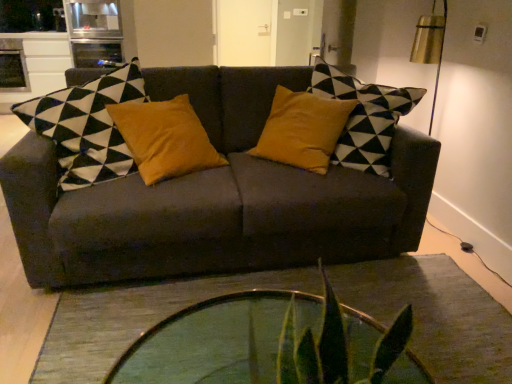
Question: Is dark gray fabric couch at center inside the boundaries of transparent glass coffee table at center, or outside?

Choices:
 (A) outside
 (B) inside

Answer: (A)

Question: Looking at the image, does dark gray fabric couch at center seem bigger or smaller compared to transparent glass coffee table at center?

Choices:
 (A) small
 (B) big

Answer: (B)

Question: From their relative heights in the image, would you say dark gray fabric couch at center is taller or shorter than transparent glass coffee table at center?

Choices:
 (A) short
 (B) tall

Answer: (B)

Question: From a real-world perspective, is transparent glass coffee table at center above or below dark gray fabric couch at center?

Choices:
 (A) below
 (B) above

Answer: (A)

Question: Looking at their shapes, would you say transparent glass coffee table at center is wider or thinner than dark gray fabric couch at center?

Choices:
 (A) thin
 (B) wide

Answer: (A)

Question: Is transparent glass coffee table at center bigger or smaller than dark gray fabric couch at center?

Choices:
 (A) big
 (B) small

Answer: (B)

Question: In the image, is transparent glass coffee table at center positioned in front of or behind dark gray fabric couch at center?

Choices:
 (A) behind
 (B) front

Answer: (B)